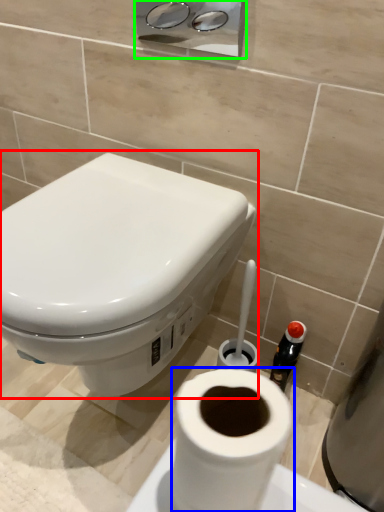
Question: Estimate the real-world distances between objects in this image. Which object is farther from toilet (highlighted by a red box), toilet paper (highlighted by a blue box) or dispenser (highlighted by a green box)?

Choices:
 (A) toilet paper
 (B) dispenser

Answer: (B)